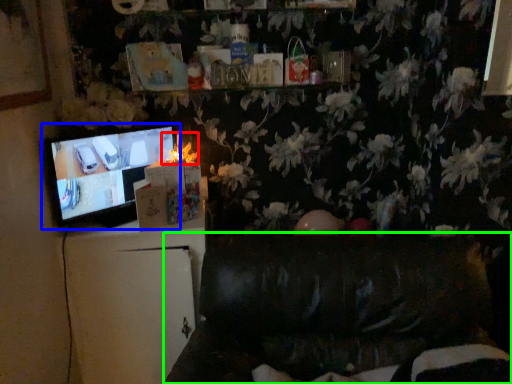
Question: Which is farther away from flower (highlighted by a red box)? television (highlighted by a blue box) or furniture (highlighted by a green box)?

Choices:
 (A) television
 (B) furniture

Answer: (B)